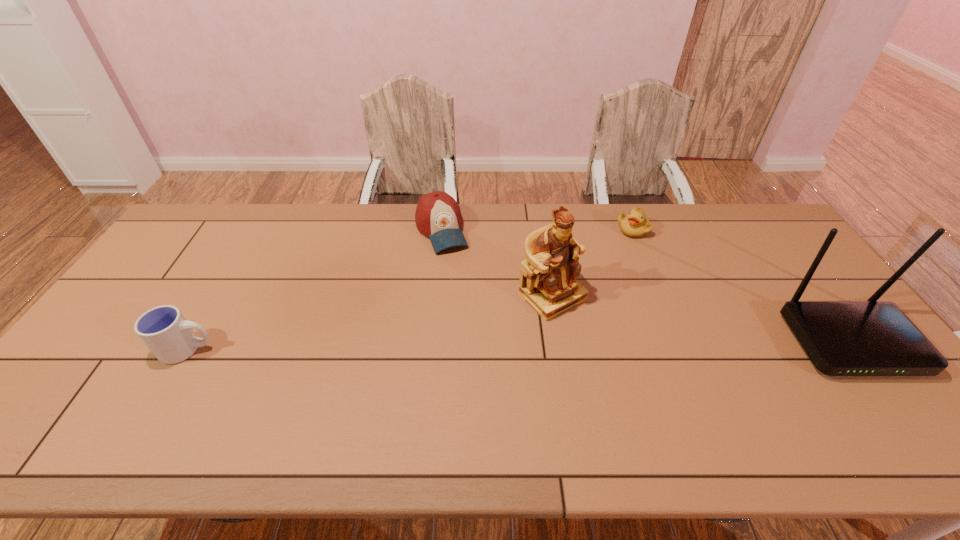
The image size is (960, 540). What are the coordinates of `vacant area at the far edge of the desktop` in the screenshot? It's located at (403, 208).

Where is `free space at the near edge of the desktop`? The height and width of the screenshot is (540, 960). free space at the near edge of the desktop is located at coordinates (428, 405).

The image size is (960, 540). What are the coordinates of `free location at the left edge of the desktop` in the screenshot? It's located at (188, 288).

Find the location of a particular element. Image resolution: width=960 pixels, height=540 pixels. vacant area at the far left corner is located at coordinates (227, 228).

This screenshot has height=540, width=960. What are the coordinates of `free spot between the baseball cap and the leftmost object` in the screenshot? It's located at (315, 289).

Locate an element on the screen. free area in between the figurine and the fourth object from right to left is located at coordinates (497, 263).

Where is `free area in between the third object from left to right and the second object from left to right`? This screenshot has height=540, width=960. free area in between the third object from left to right and the second object from left to right is located at coordinates pyautogui.click(x=497, y=263).

Where is `vacant space that's between the fourth object from right to left and the leftmost object`? The height and width of the screenshot is (540, 960). vacant space that's between the fourth object from right to left and the leftmost object is located at coordinates (315, 289).

Find the location of a particular element. The width and height of the screenshot is (960, 540). free space between the rightmost object and the second object from left to right is located at coordinates (645, 286).

Locate an element on the screen. The height and width of the screenshot is (540, 960). unoccupied area between the figurine and the fourth object from right to left is located at coordinates (497, 263).